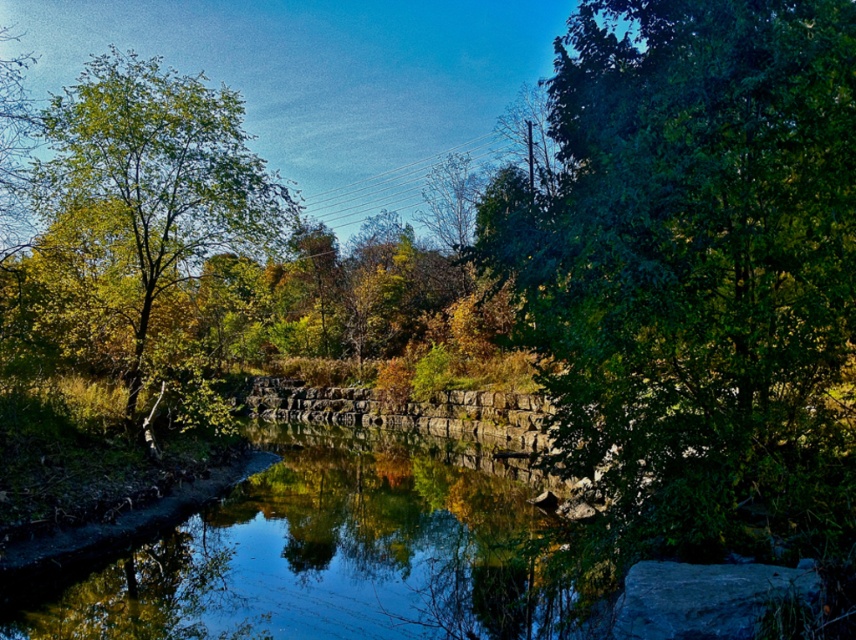
Measure the distance between green leafy tree at upper right and clear water at center.

The distance of green leafy tree at upper right from clear water at center is 4.87 meters.

Where is `green leafy tree at upper right`? green leafy tree at upper right is located at coordinates (698, 268).

Does point (616, 173) come farther from viewer compared to point (574, 596)?

No, (616, 173) is in front of (574, 596).

What are the coordinates of `green leafy tree at upper right` in the screenshot? It's located at (698, 268).

Is green leafy tree at upper right positioned in front of green leafy tree at left?

Yes, it is.

You are a GUI agent. You are given a task and a screenshot of the screen. Output one action in this format:
    pyautogui.click(x=<x>, y=<y>)
    Task: Click on the green leafy tree at upper right
    The image size is (856, 640).
    Given the screenshot: What is the action you would take?
    pyautogui.click(x=698, y=268)

Is clear water at center closer to the viewer compared to green leafy tree at left?

Yes.

Based on the photo, who is positioned more to the left, clear water at center or green leafy tree at left?

Positioned to the left is green leafy tree at left.

The width and height of the screenshot is (856, 640). What do you see at coordinates (343, 554) in the screenshot?
I see `clear water at center` at bounding box center [343, 554].

The height and width of the screenshot is (640, 856). Find the location of `clear water at center`. clear water at center is located at coordinates (343, 554).